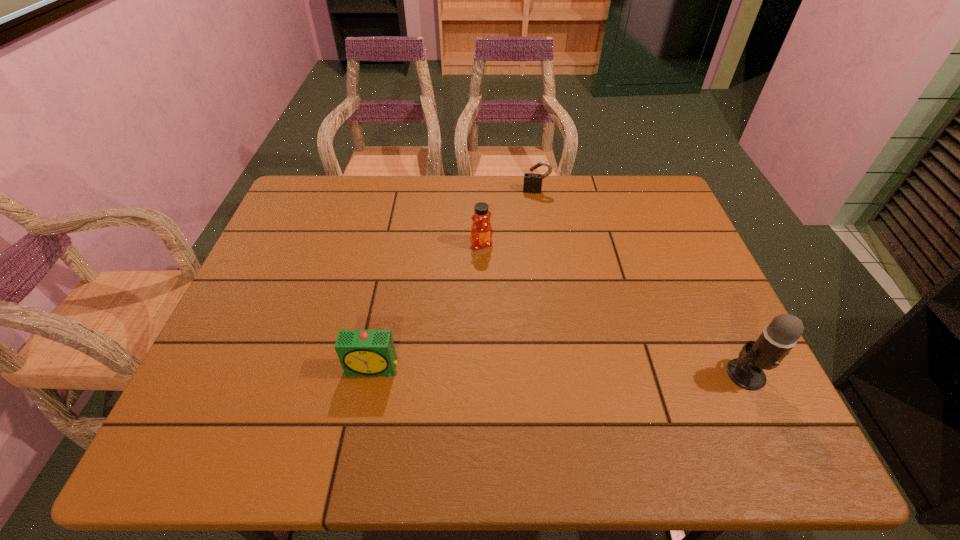
This screenshot has height=540, width=960. What are the coordinates of `the leftmost object` in the screenshot? It's located at (361, 352).

Identify the location of microphone. The height and width of the screenshot is (540, 960). (778, 338).

The image size is (960, 540). I want to click on the tallest object, so click(x=778, y=338).

This screenshot has height=540, width=960. Identify the location of the third object from right to left. (481, 231).

The image size is (960, 540). Identify the location of the third nearest object. (481, 231).

Where is `the farthest object`? the farthest object is located at coordinates (532, 181).

Locate an element on the screen. The image size is (960, 540). padlock is located at coordinates (532, 181).

I want to click on free location located 0.230m on the left of the rightmost object, so click(621, 374).

You are a GUI agent. You are given a task and a screenshot of the screen. Output one action in this format:
    pyautogui.click(x=<x>, y=<y>)
    Task: Click on the free region located 0.200m on the front label of the second tallest object
    The image size is (960, 540).
    Given the screenshot: What is the action you would take?
    517,300

Where is `free location located on the front label of the second tallest object`? The height and width of the screenshot is (540, 960). free location located on the front label of the second tallest object is located at coordinates (551, 352).